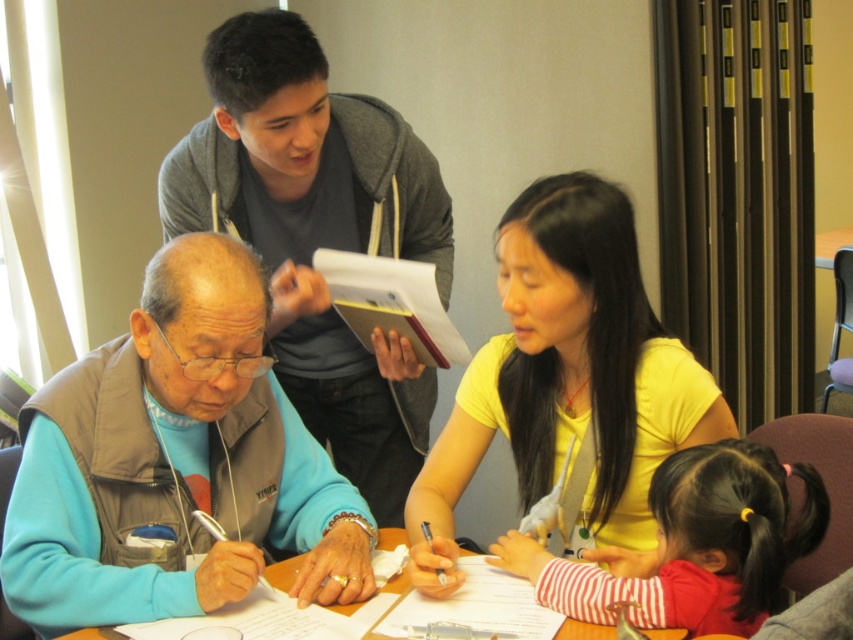
Question: Can you confirm if gray hoodie at upper center is positioned to the left of striped fabric shirt at lower right?

Choices:
 (A) no
 (B) yes

Answer: (B)

Question: Which object is closer to the camera taking this photo?

Choices:
 (A) striped fabric shirt at lower right
 (B) yellow matte shirt at center

Answer: (A)

Question: Which object is closer to the camera taking this photo?

Choices:
 (A) gray hoodie at upper center
 (B) yellow matte shirt at center
 (C) striped fabric shirt at lower right

Answer: (C)

Question: Is gray hoodie at upper center smaller than blue fleece vest at center?

Choices:
 (A) no
 (B) yes

Answer: (A)

Question: Considering the real-world distances, which object is farthest from the striped fabric shirt at lower right?

Choices:
 (A) white paper at center
 (B) yellow matte shirt at center
 (C) gray hoodie at upper center
 (D) blue fleece vest at center

Answer: (C)

Question: Is striped fabric shirt at lower right thinner than white paper at center?

Choices:
 (A) yes
 (B) no

Answer: (B)